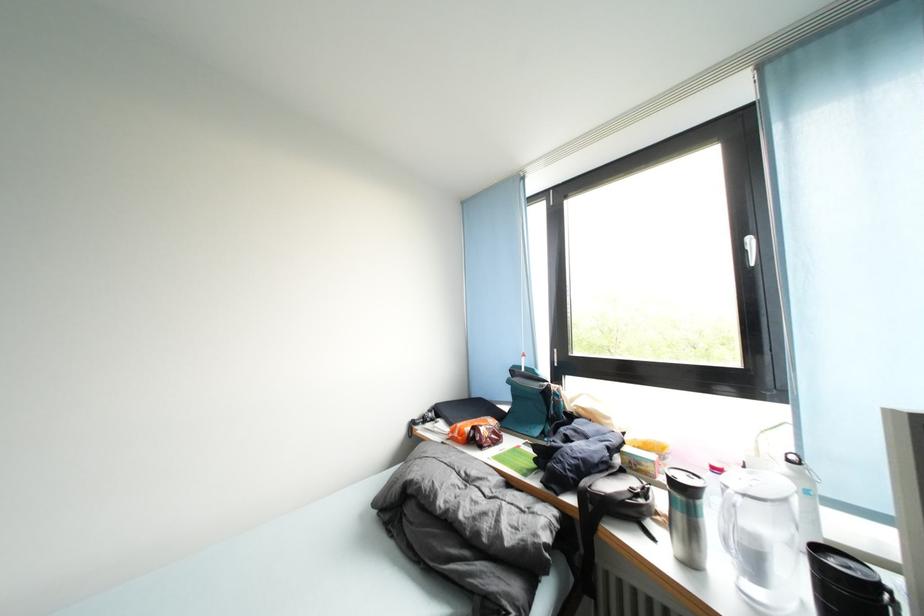
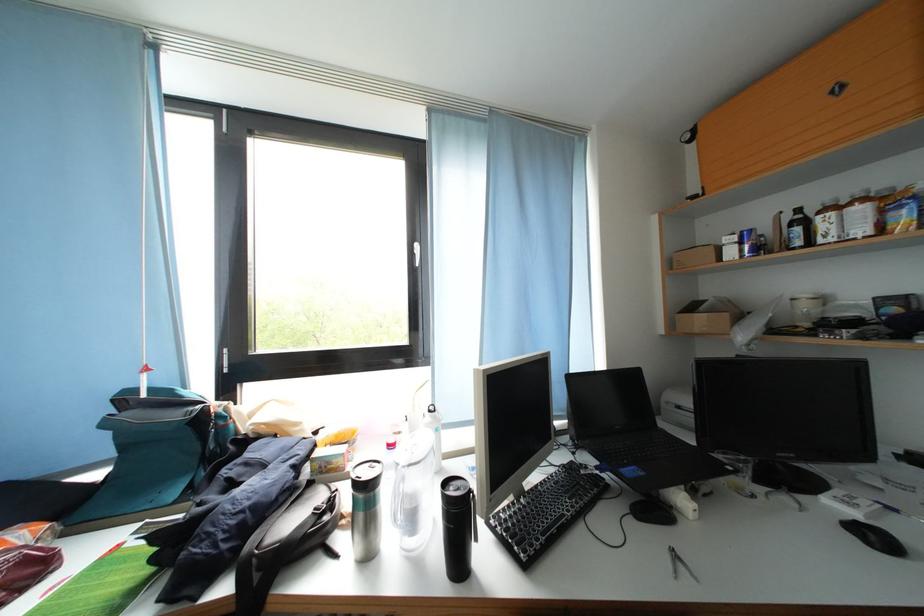
The point at [825,552] is marked in the first image. Where is the corresponding point in the second image?

(454, 488)